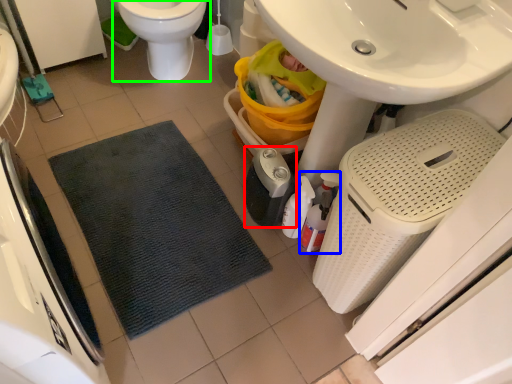
Question: Which is farther away from appliance (highlighted by a red box)? cleaning product (highlighted by a blue box) or toilet (highlighted by a green box)?

Choices:
 (A) cleaning product
 (B) toilet

Answer: (B)